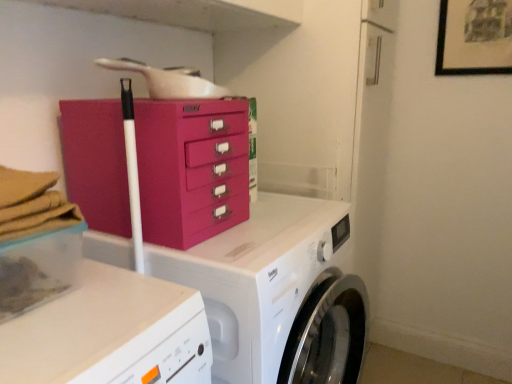
Question: Is point (449, 21) positioned closer to the camera than point (187, 168)?

Choices:
 (A) farther
 (B) closer

Answer: (A)

Question: Looking at the image, does black matte picture frame at upper right seem bigger or smaller compared to fuchsia plastic chest of drawers at center?

Choices:
 (A) small
 (B) big

Answer: (A)

Question: Estimate the real-world distances between objects in this image. Which object is farther from the fuchsia plastic chest of drawers at center?

Choices:
 (A) white glossy washing machine at center
 (B) clear plastic container at lower left
 (C) black matte picture frame at upper right

Answer: (C)

Question: Estimate the real-world distances between objects in this image. Which object is farther from the white glossy washing machine at center?

Choices:
 (A) clear plastic container at lower left
 (B) fuchsia plastic chest of drawers at center
 (C) black matte picture frame at upper right

Answer: (C)